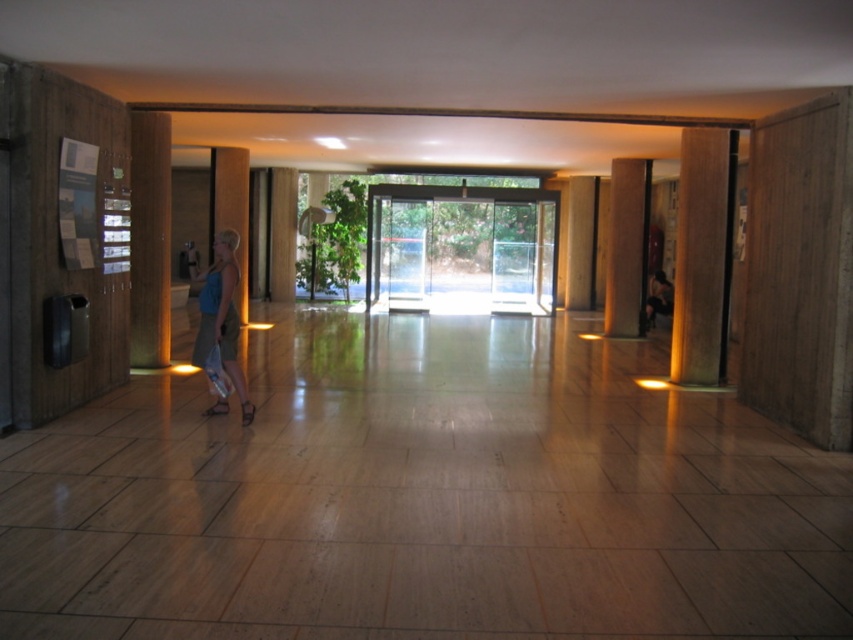
Based on the photo, you are navigating through the corridor and need to reach a specific location. There are two points marked in the scene, point 1 at coordinates point (692, 228) and point 2 at coordinates point (619, 291). Which point is closer to you as you stand in the corridor?

Point (692, 228) is closer to the viewer than point (619, 291), so you are closer to point 1.

You are standing in the corridor and need to pass between the two brown polished wood pillars. The brown polished wood pillar at right and the brown polished wood pillar at center are in your way. Which pillar should you move closer to if you want to navigate through the narrowest space between them?

The brown polished wood pillar at center is the narrower one, so moving closer to it would allow you to navigate through the narrowest space between the brown polished wood pillar at right and the brown polished wood pillar at center.